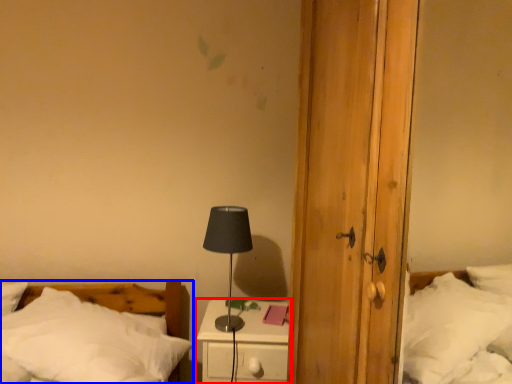
Question: Which point is further to the camera, nightstand (highlighted by a red box) or bed (highlighted by a blue box)?

Choices:
 (A) nightstand
 (B) bed

Answer: (A)